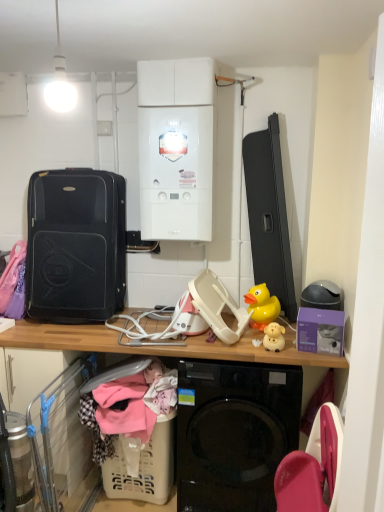
Question: Does beige plastic laundry basket at lower left have a lesser width compared to wooden desk at center?

Choices:
 (A) no
 (B) yes

Answer: (B)

Question: From a real-world perspective, is beige plastic laundry basket at lower left positioned under wooden desk at center based on gravity?

Choices:
 (A) yes
 (B) no

Answer: (A)

Question: Does beige plastic laundry basket at lower left have a greater height compared to wooden desk at center?

Choices:
 (A) no
 (B) yes

Answer: (A)

Question: Would you say beige plastic laundry basket at lower left is outside wooden desk at center?

Choices:
 (A) yes
 (B) no

Answer: (B)

Question: Is beige plastic laundry basket at lower left positioned before wooden desk at center?

Choices:
 (A) yes
 (B) no

Answer: (B)

Question: In terms of height, does beige plastic laundry basket at lower left look taller or shorter compared to black hardshell suitcase at left?

Choices:
 (A) tall
 (B) short

Answer: (B)

Question: In the image, is beige plastic laundry basket at lower left positioned in front of or behind black hardshell suitcase at left?

Choices:
 (A) front
 (B) behind

Answer: (A)

Question: Looking at their shapes, would you say beige plastic laundry basket at lower left is wider or thinner than black hardshell suitcase at left?

Choices:
 (A) wide
 (B) thin

Answer: (B)

Question: From the image's perspective, is beige plastic laundry basket at lower left above or below black hardshell suitcase at left?

Choices:
 (A) above
 (B) below

Answer: (B)

Question: In terms of size, does beige plastic laundry basket at lower left appear bigger or smaller than white glossy boiler at upper center?

Choices:
 (A) small
 (B) big

Answer: (A)

Question: In the image, is beige plastic laundry basket at lower left positioned in front of or behind white glossy boiler at upper center?

Choices:
 (A) front
 (B) behind

Answer: (A)

Question: Does point (117, 479) appear closer or farther from the camera than point (177, 176)?

Choices:
 (A) farther
 (B) closer

Answer: (A)

Question: Looking at their shapes, would you say beige plastic laundry basket at lower left is wider or thinner than white glossy boiler at upper center?

Choices:
 (A) wide
 (B) thin

Answer: (B)

Question: Is point (117, 485) closer or farther from the camera than point (185, 354)?

Choices:
 (A) farther
 (B) closer

Answer: (A)

Question: From a real-world perspective, is beige plastic laundry basket at lower left positioned above or below wooden desk at center?

Choices:
 (A) above
 (B) below

Answer: (B)